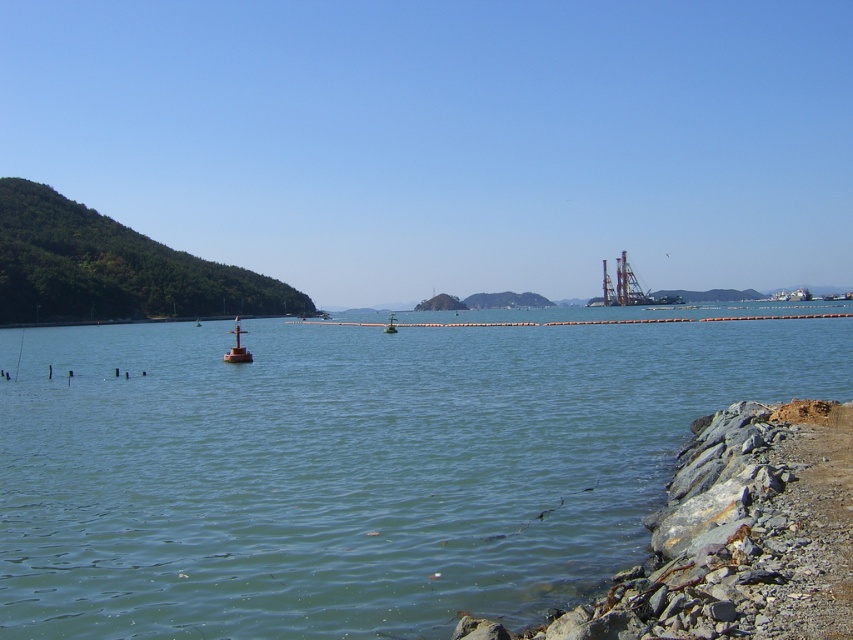
You are a marine biologist observing this coastal scene. You need to determine which object is larger between the metallic gray drilling rig at center right and the green matte buoy at center. Based on the scene, which one is bigger?

The metallic gray drilling rig at center right is bigger than the green matte buoy at center.

You are a sailor navigating a small boat and need to pass through the area between the green water at center and the smooth orange buoy at center. Based on their positions, can your boat safely navigate this path?

The green water at center is above the smooth orange buoy at center, meaning the buoy is positioned lower than the water in that area. Since the buoy is floating on the water, your boat should be able to safely navigate around or past it without any obstruction.

You are a boat captain navigating through the coastal scene. You see the green water at center and the smooth orange buoy at center. Which object is closer to your boat if you are approaching from the shoreline?

The green water at center is closer to your boat because it is in front of the smooth orange buoy at center, meaning the buoy is further away from the shoreline.